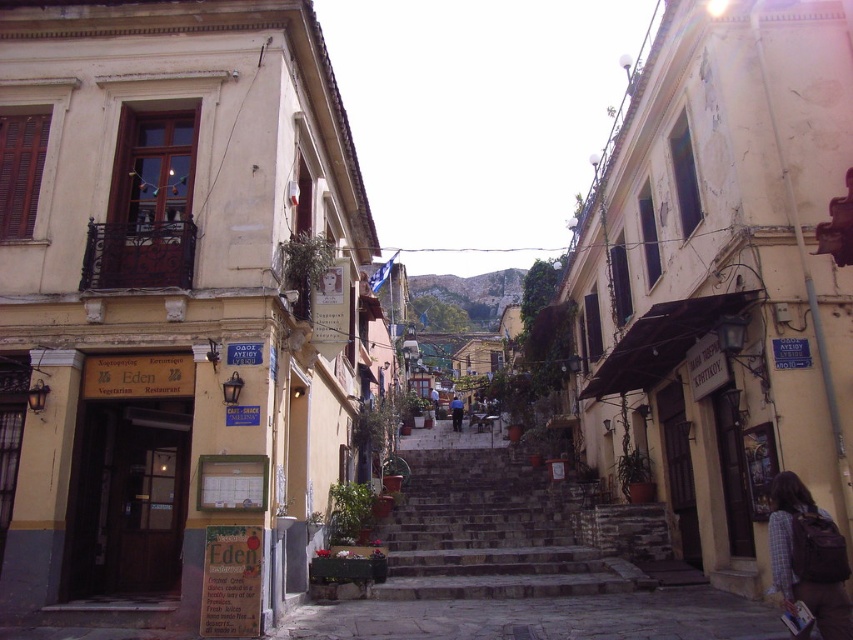
Measure the distance between point (833, 582) and camera.

Point (833, 582) is 22.50 feet away from camera.

Is point (793, 573) farther from viewer compared to point (456, 417)?

No, (793, 573) is closer to viewer.

Is point (782, 545) positioned behind point (453, 406)?

No.

Identify the location of brown fabric backpack at lower right. Image resolution: width=853 pixels, height=640 pixels. (808, 557).

Between stone steps at center and blue jeans at center, which one is positioned lower?

stone steps at center is lower down.

Consider the image. Can you confirm if stone steps at center is bigger than blue jeans at center?

Yes, stone steps at center is bigger than blue jeans at center.

What do you see at coordinates (491, 532) in the screenshot? The width and height of the screenshot is (853, 640). I see `stone steps at center` at bounding box center [491, 532].

Locate an element on the screen. stone steps at center is located at coordinates (491, 532).

Between stone steps at center and brown fabric backpack at lower right, which one appears on the left side from the viewer's perspective?

From the viewer's perspective, stone steps at center appears more on the left side.

Looking at this image, is stone steps at center below brown fabric backpack at lower right?

Yes, stone steps at center is below brown fabric backpack at lower right.

What do you see at coordinates (491, 532) in the screenshot? I see `stone steps at center` at bounding box center [491, 532].

Locate an element on the screen. stone steps at center is located at coordinates (491, 532).